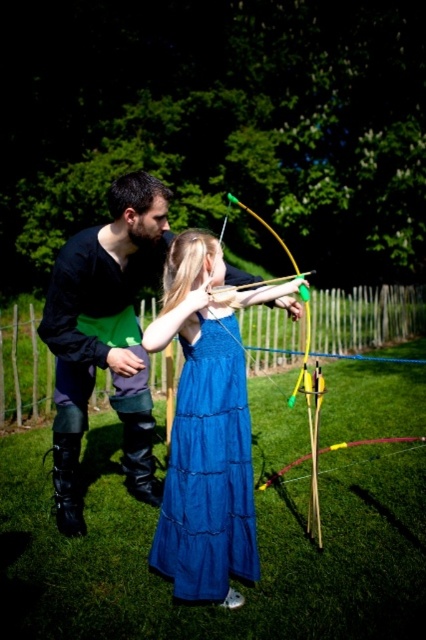
Question: Does black leather boots at left appear over yellow wood bow at center?

Choices:
 (A) no
 (B) yes

Answer: (A)

Question: Which point appears closest to the camera in this image?

Choices:
 (A) (308, 371)
 (B) (143, 413)

Answer: (A)

Question: Is black leather boots at left below blue cotton dress at center?

Choices:
 (A) no
 (B) yes

Answer: (A)

Question: Considering the real-world distances, which object is closest to the black leather boots at left?

Choices:
 (A) yellow wood bow at center
 (B) blue cotton dress at center

Answer: (B)

Question: Which object is the farthest from the blue cotton dress at center?

Choices:
 (A) yellow wood bow at center
 (B) black leather boots at left

Answer: (A)

Question: Does blue cotton dress at center have a greater width compared to yellow wood bow at center?

Choices:
 (A) no
 (B) yes

Answer: (A)